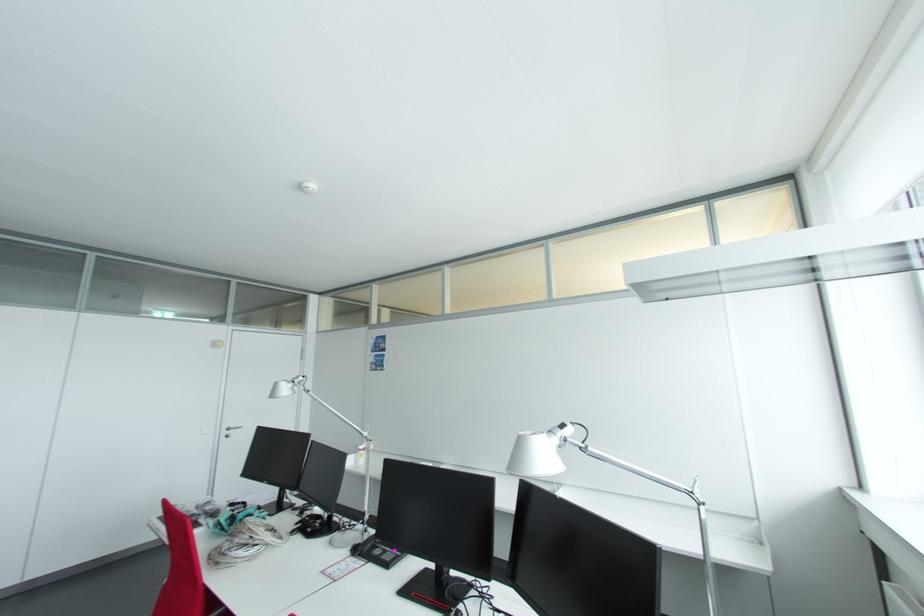
Image resolution: width=924 pixels, height=616 pixels. Describe the element at coordinates (362, 546) in the screenshot. I see `a black phone handset` at that location.